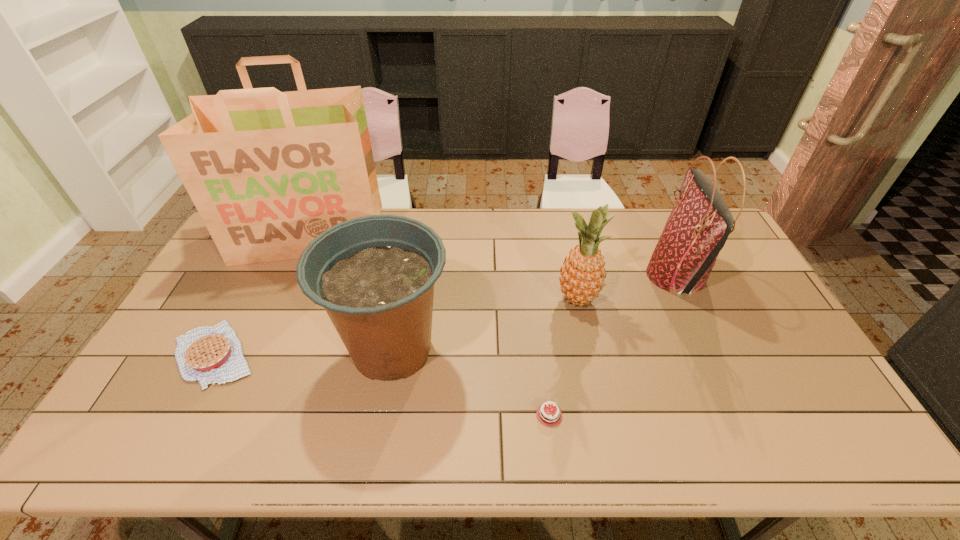
I want to click on vacant region at the far edge of the desktop, so click(x=532, y=215).

Identify the location of vacant point at the near edge. This screenshot has width=960, height=540. (329, 434).

At what (x,y) coordinates should I click in order to perform the action: click on vacant space at the left edge of the desktop. Please return your answer as a coordinate pair (x, y). Looking at the image, I should click on (239, 284).

The width and height of the screenshot is (960, 540). In the image, there is a desktop. What are the coordinates of `vacant space at the near right corner` in the screenshot? It's located at (855, 451).

Find the location of `free space between the pineapple and the rightmost object`. free space between the pineapple and the rightmost object is located at coordinates (627, 288).

The width and height of the screenshot is (960, 540). Identify the location of empty location between the fifth tallest object and the flowerpot. (303, 352).

Identify the location of vacant area that lies between the grocery bag and the pineapple. (444, 267).

Find the location of a particular element. Image resolution: width=960 pixels, height=540 pixels. free space between the pineapple and the grocery bag is located at coordinates (444, 267).

The image size is (960, 540). Find the location of `vacant space that is in between the flowerpot and the pie`. vacant space that is in between the flowerpot and the pie is located at coordinates (303, 352).

Find the location of a particular element. empty space between the chocolate cake and the pie is located at coordinates (382, 384).